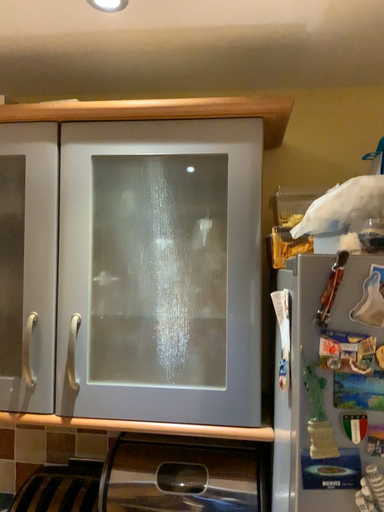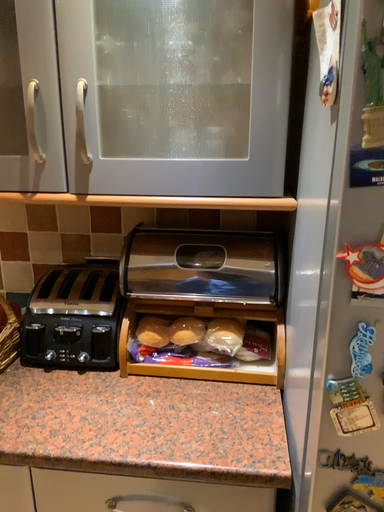
Question: Which way did the camera rotate in the video?

Choices:
 (A) rotated upward
 (B) rotated downward

Answer: (B)